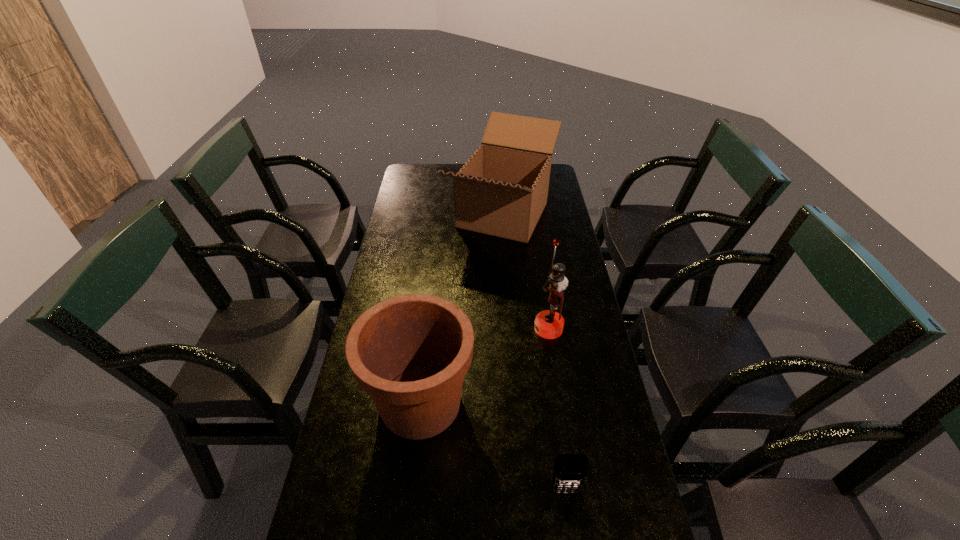
Where is `free space located on the right of the flowerpot`? This screenshot has width=960, height=540. free space located on the right of the flowerpot is located at coordinates coord(526,403).

You are a GUI agent. You are given a task and a screenshot of the screen. Output one action in this format:
    pyautogui.click(x=<x>, y=<y>)
    Task: Click on the blank space located on the screen of the shortest object
    Image resolution: width=960 pixels, height=540 pixels.
    Given the screenshot: What is the action you would take?
    pyautogui.click(x=571, y=536)

Locate an element on the screen. object present at the far edge is located at coordinates (502, 190).

I want to click on object located at the left edge, so click(x=410, y=353).

The height and width of the screenshot is (540, 960). In order to click on nutcracker that is at the right edge in this screenshot , I will do point(549,324).

Identify the location of box situated at the right edge. (502, 190).

Identify the location of cellular telephone at the right edge. (570, 470).

The image size is (960, 540). I want to click on object present at the far right corner, so click(x=502, y=190).

In order to click on vacant space at the far edge of the desktop in this screenshot , I will do `click(444, 179)`.

I want to click on free space at the left edge of the desktop, so click(399, 294).